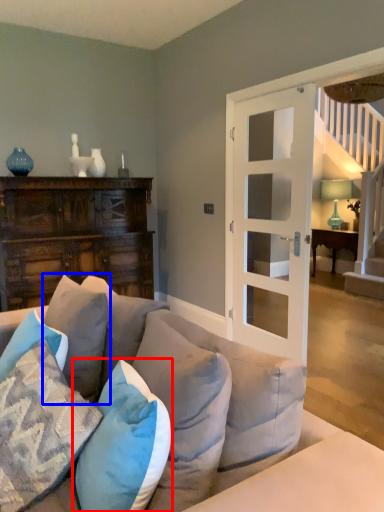
Question: Which object appears farthest to the camera in this image, pillow (highlighted by a red box) or pillow (highlighted by a blue box)?

Choices:
 (A) pillow
 (B) pillow

Answer: (B)